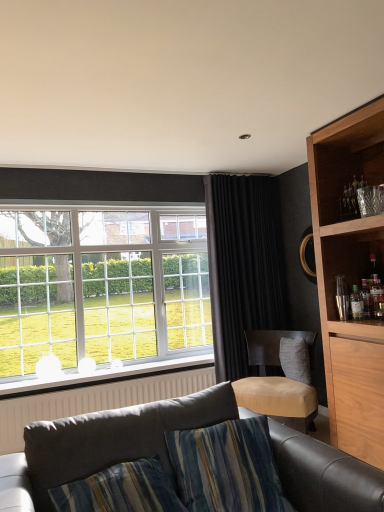
Question: Does black velvet curtain at center lie behind white textured radiator at lower left?

Choices:
 (A) yes
 (B) no

Answer: (A)

Question: Is black velvet curtain at center looking in the opposite direction of white textured radiator at lower left?

Choices:
 (A) yes
 (B) no

Answer: (B)

Question: Is black velvet curtain at center completely or partially outside of white textured radiator at lower left?

Choices:
 (A) yes
 (B) no

Answer: (A)

Question: Is black velvet curtain at center not near white textured radiator at lower left?

Choices:
 (A) no
 (B) yes

Answer: (B)

Question: Can you confirm if black velvet curtain at center is smaller than white textured radiator at lower left?

Choices:
 (A) no
 (B) yes

Answer: (A)

Question: Looking at the image, does translucent glass bottle at right, the 2th bottle from the right, seem bigger or smaller compared to black velvet curtain at center?

Choices:
 (A) small
 (B) big

Answer: (A)

Question: From the image's perspective, is translucent glass bottle at right, the 2th bottle from the right, above or below black velvet curtain at center?

Choices:
 (A) above
 (B) below

Answer: (A)

Question: In the image, is translucent glass bottle at right, the 2th bottle from the right, on the left side or the right side of black velvet curtain at center?

Choices:
 (A) left
 (B) right

Answer: (B)

Question: Considering their positions, is translucent glass bottle at right, which is the 1th bottle in left-to-right order, located in front of or behind black velvet curtain at center?

Choices:
 (A) behind
 (B) front

Answer: (B)

Question: Looking at the image, does white textured radiator at lower left seem bigger or smaller compared to translucent glass bottles at right, which appears as the 2th bottle when viewed from the left?

Choices:
 (A) big
 (B) small

Answer: (A)

Question: From a real-world perspective, is white textured radiator at lower left positioned above or below translucent glass bottles at right, the first bottle viewed from the right?

Choices:
 (A) below
 (B) above

Answer: (A)

Question: Choose the correct answer: Is white textured radiator at lower left inside translucent glass bottles at right, the first bottle viewed from the right, or outside it?

Choices:
 (A) inside
 (B) outside

Answer: (B)

Question: In terms of width, does white textured radiator at lower left look wider or thinner when compared to translucent glass bottles at right, the first bottle viewed from the right?

Choices:
 (A) wide
 (B) thin

Answer: (A)

Question: Is point (254, 264) positioned closer to the camera than point (139, 384)?

Choices:
 (A) farther
 (B) closer

Answer: (A)

Question: From a real-world perspective, is black velvet curtain at center above or below white textured radiator at lower left?

Choices:
 (A) below
 (B) above

Answer: (B)